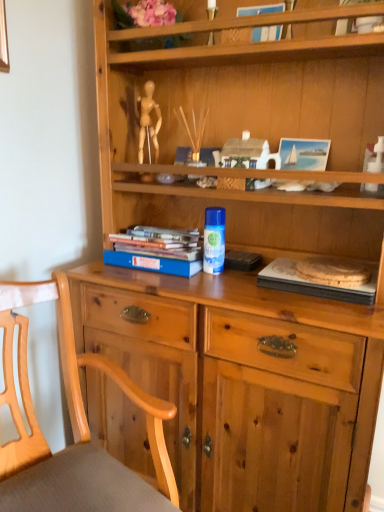
Question: Considering the relative positions of wooden chair at lower left and hardcover books at left, which ranks as the 1th paperback book in left-to-right order, in the image provided, is wooden chair at lower left to the left or to the right of hardcover books at left, which ranks as the 1th paperback book in left-to-right order,?

Choices:
 (A) right
 (B) left

Answer: (B)

Question: Is wooden chair at lower left spatially inside hardcover books at left, acting as the 2th paperback book starting from the right, or outside of it?

Choices:
 (A) inside
 (B) outside

Answer: (B)

Question: Estimate the real-world distances between objects in this image. Which object is closer to the blue hardcover book at upper center?

Choices:
 (A) wooden textured book at lower right, arranged as the second paperback book when viewed from the left
 (B) wooden chair at lower left
 (C) white plastic toy at upper right
 (D) hardcover books at left, acting as the 2th paperback book starting from the right

Answer: (C)

Question: Which object is the closest to the hardcover books at left, acting as the 2th paperback book starting from the right?

Choices:
 (A) wooden textured book at lower right, arranged as the second paperback book when viewed from the left
 (B) blue hardcover book at upper center
 (C) wooden chair at lower left
 (D) white plastic toy at upper right

Answer: (A)